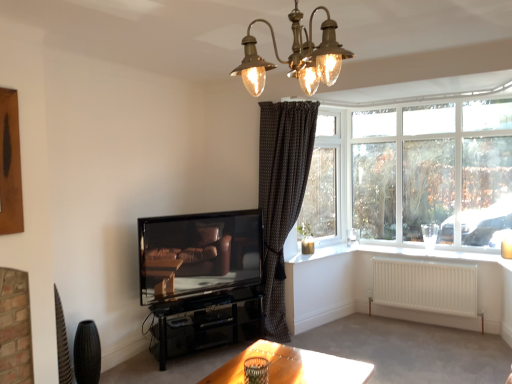
The width and height of the screenshot is (512, 384). Find the location of `vacant location below white matte radiator at lower right (from a real-world perspective)`. vacant location below white matte radiator at lower right (from a real-world perspective) is located at coordinates (425, 328).